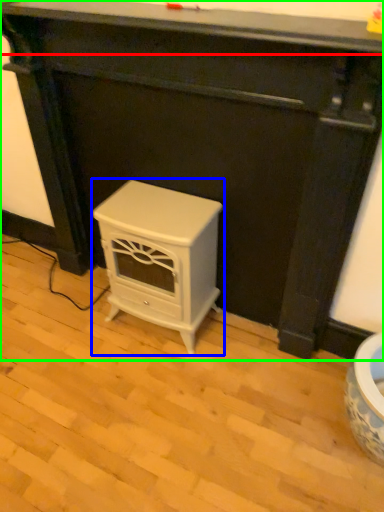
Question: Which is farther away from counter top (highlighted by a red box)? furniture (highlighted by a blue box) or furniture (highlighted by a green box)?

Choices:
 (A) furniture
 (B) furniture

Answer: (A)